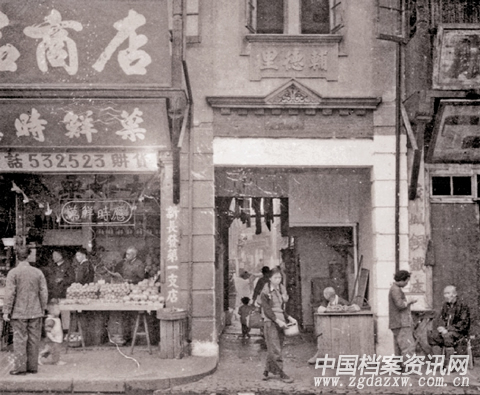
The image size is (480, 395). Identify the location of table legs. [134, 330], [147, 330], [79, 332], [70, 333].